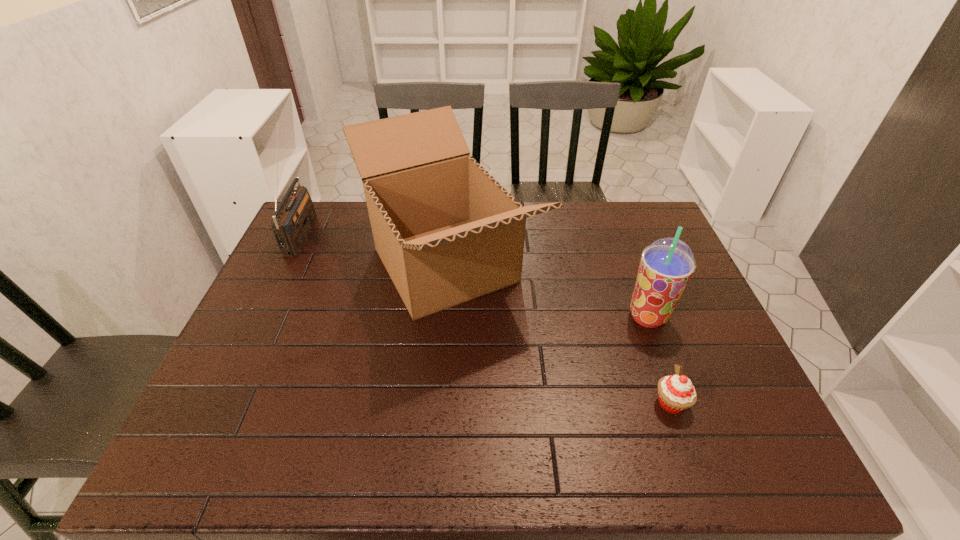
You are a GUI agent. You are given a task and a screenshot of the screen. Output one action in this format:
    pyautogui.click(x=<x>, y=<y>)
    Task: Click on the box
    This screenshot has width=960, height=540.
    Given the screenshot: What is the action you would take?
    pyautogui.click(x=447, y=232)

Locate an element on the screen. Image resolution: width=960 pixels, height=540 pixels. the leftmost object is located at coordinates (295, 216).

The width and height of the screenshot is (960, 540). I want to click on smoothie, so click(667, 264).

Identify the location of cupcake. (676, 393).

The height and width of the screenshot is (540, 960). I want to click on the nearest object, so pyautogui.click(x=676, y=393).

This screenshot has width=960, height=540. I want to click on vacant position located 0.100m on the right of the third object from right to left, so click(x=573, y=265).

At what (x,y) coordinates should I click in order to perform the action: click on free point located on the front-facing side of the leftmost object. Please return your answer as a coordinate pair (x, y). Looking at the image, I should click on (354, 233).

The height and width of the screenshot is (540, 960). What are the coordinates of `vacant space situated on the front of the smoothie` in the screenshot? It's located at (689, 430).

This screenshot has height=540, width=960. In order to click on vacant region located 0.280m on the left of the cupcake in this screenshot , I will do `click(527, 403)`.

The height and width of the screenshot is (540, 960). Find the location of `box at the far edge`. box at the far edge is located at coordinates (447, 232).